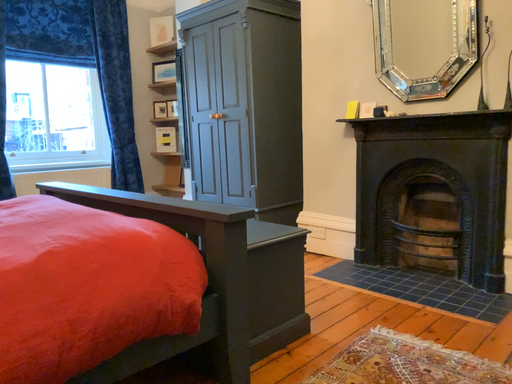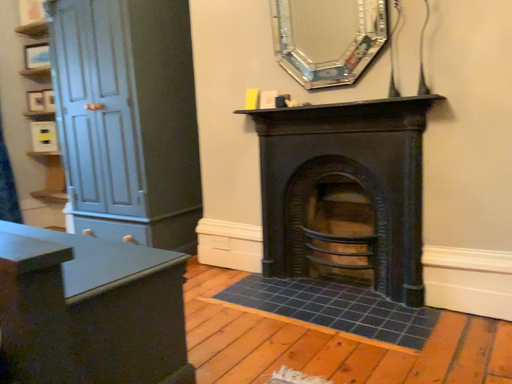
Question: How did the camera likely rotate when shooting the video?

Choices:
 (A) rotated right
 (B) rotated left

Answer: (A)